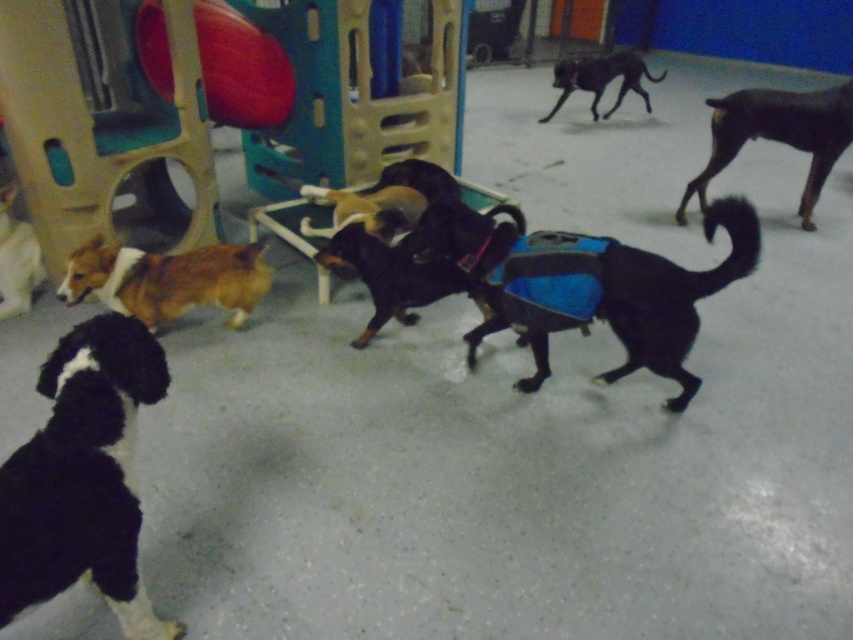
Question: Is black fluffy dog at lower left wider than black smooth coat at right?

Choices:
 (A) yes
 (B) no

Answer: (B)

Question: Which object appears farthest from the camera in this image?

Choices:
 (A) brown and white fur at lower left
 (B) brown fur dog at center
 (C) black fluffy dog at lower left

Answer: (A)

Question: Which point is closer to the camera taking this photo?

Choices:
 (A) click(x=97, y=246)
 (B) click(x=7, y=189)
 (C) click(x=433, y=284)
 (D) click(x=608, y=376)

Answer: (A)

Question: Is black fluffy dog at lower left below brown and white fur at left?

Choices:
 (A) yes
 (B) no

Answer: (A)

Question: Which point is farther to the camera?

Choices:
 (A) black smooth coat at right
 (B) brown and white fur at lower left
 (C) brown fur dog at center
 (D) brown and white fur at left

Answer: (A)

Question: Does brown fur dog at center have a lesser width compared to black smooth dog at upper right?

Choices:
 (A) yes
 (B) no

Answer: (A)